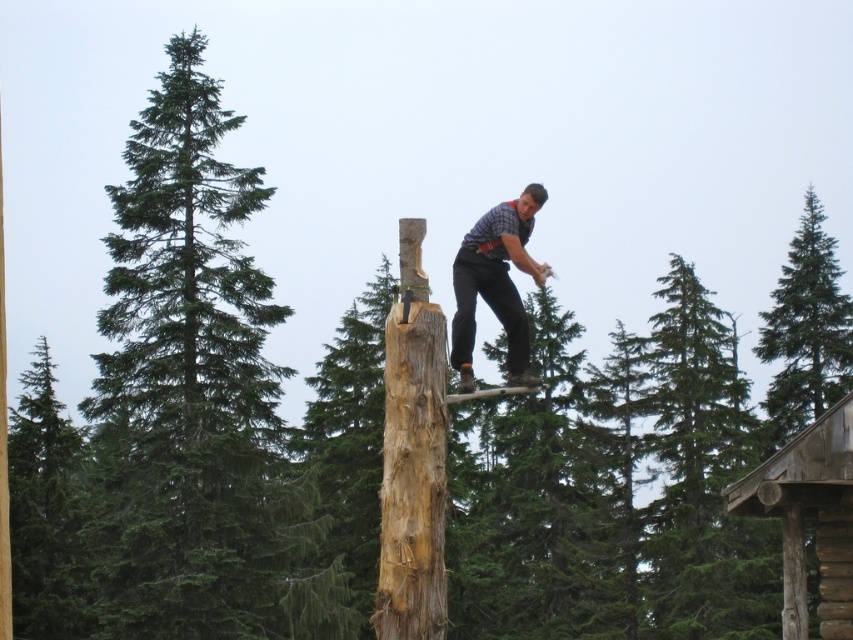
Question: Can you confirm if green textured pine at upper right is smaller than matte plaid shirt at center?

Choices:
 (A) no
 (B) yes

Answer: (A)

Question: Which point is closer to the camera taking this photo?

Choices:
 (A) (135, 308)
 (B) (781, 349)
 (C) (20, 572)
 (D) (468, 387)

Answer: (D)

Question: Does green coniferous tree at left appear over green textured pine at upper right?

Choices:
 (A) no
 (B) yes

Answer: (B)

Question: Which object appears closest to the camera in this image?

Choices:
 (A) green textured tree at left
 (B) matte plaid shirt at center

Answer: (B)

Question: Is green textured tree at left thinner than matte plaid shirt at center?

Choices:
 (A) yes
 (B) no

Answer: (B)

Question: Which of the following is the closest to the observer?

Choices:
 (A) (775, 292)
 (B) (67, 634)
 (C) (453, 353)
 (D) (210, 108)

Answer: (C)